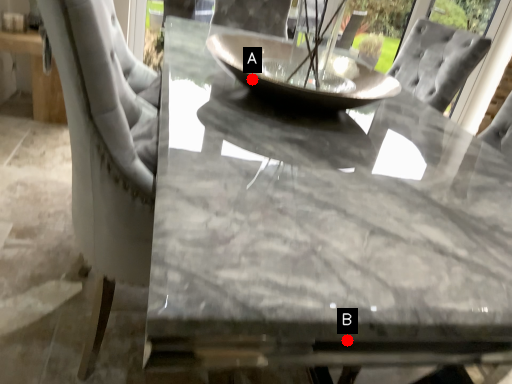
Question: Two points are circled on the image, labeled by A and B beside each circle. Which of the following is the farthest from the observer?

Choices:
 (A) A is further
 (B) B is further

Answer: (A)